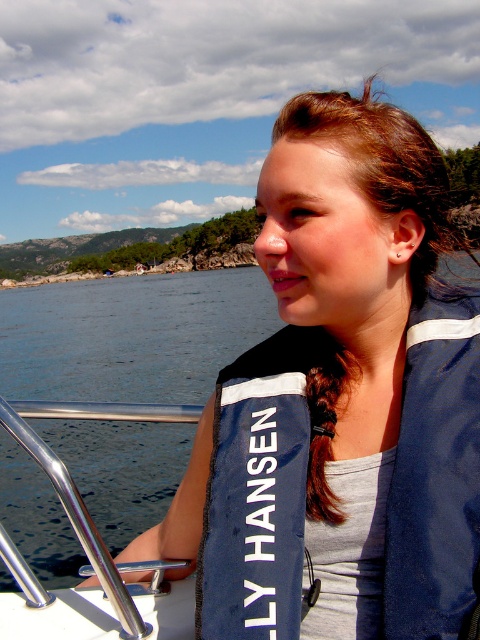
Question: Is navy blue life vest at center wider than brushed metal railing at lower left?

Choices:
 (A) yes
 (B) no

Answer: (A)

Question: Among these objects, which one is nearest to the camera?

Choices:
 (A) brushed metal railing at lower left
 (B) navy blue life vest at center
 (C) navy blue fabric life jacket at center

Answer: (C)

Question: Is navy blue life vest at center above navy blue fabric life jacket at center?

Choices:
 (A) no
 (B) yes

Answer: (B)

Question: Which object is positioned closest to the navy blue fabric life jacket at center?

Choices:
 (A) navy blue life vest at center
 (B) brushed metal railing at lower left

Answer: (A)

Question: Estimate the real-world distances between objects in this image. Which object is closer to the navy blue fabric life jacket at center?

Choices:
 (A) brushed metal railing at lower left
 (B) navy blue life vest at center

Answer: (B)

Question: Can you confirm if navy blue life vest at center is wider than brushed metal railing at lower left?

Choices:
 (A) no
 (B) yes

Answer: (B)